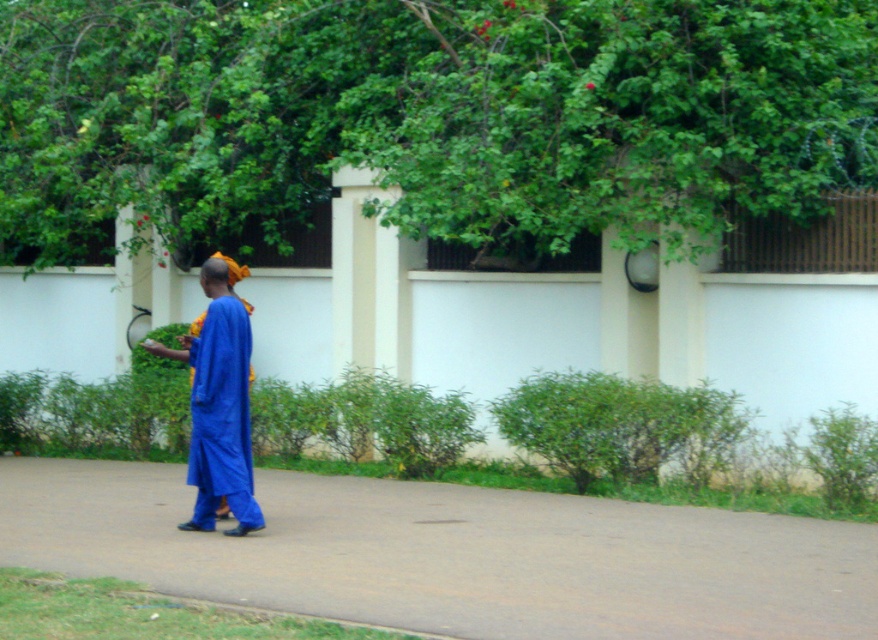
You are standing on the smooth concrete pavement at center and want to hand an object to the person wearing the blue cotton robe at center. Which direction should you move to reach them?

The smooth concrete pavement at center is to the right of blue cotton robe at center, so you should move to your left to reach the person wearing the blue cotton robe at center.

You are standing at the point labeled point (x=428, y=116). What is the nearest object to you in the scene?

The nearest object to you is the green leafy tree at upper center because the point (x=428, y=116) is located on it.